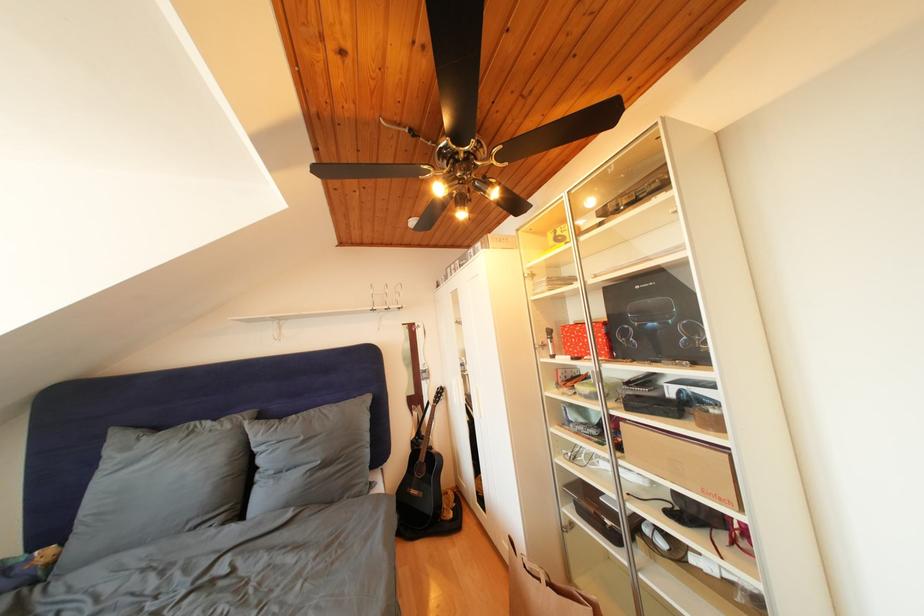
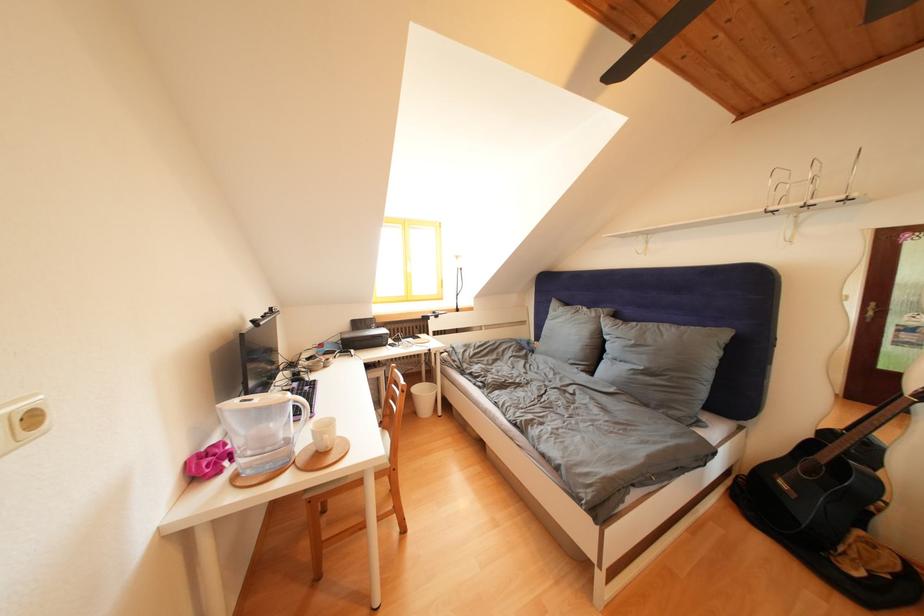
Where in the second image is the point corresponding to [236,432] from the first image?

(602, 320)